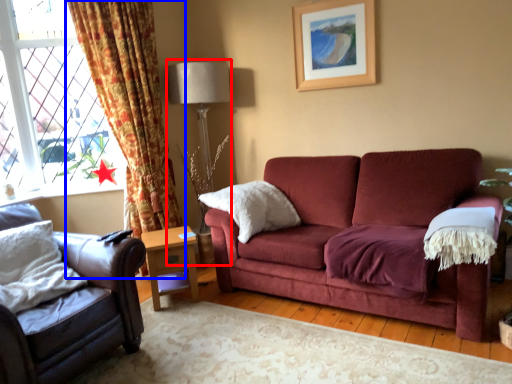
Question: Which point is closer to the camera, table lamp (highlighted by a red box) or curtain (highlighted by a blue box)?

Choices:
 (A) table lamp
 (B) curtain

Answer: (B)